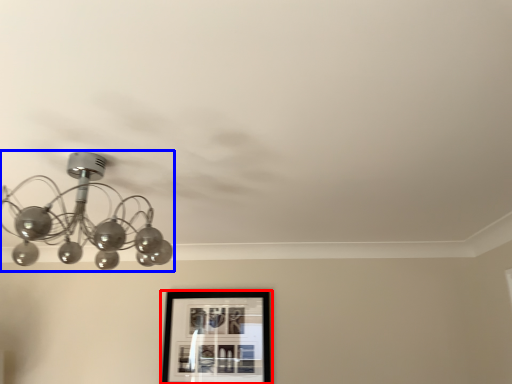
Question: Which of the following is the closest to the observer, picture frame (highlighted by a red box) or lamp (highlighted by a blue box)?

Choices:
 (A) picture frame
 (B) lamp

Answer: (B)